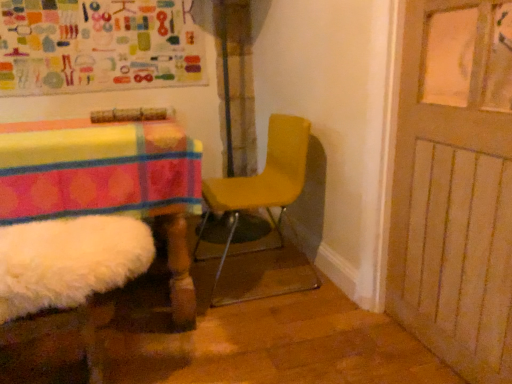
Find the location of a particular element. The image size is (512, 384). vacant space in front of yellow matte chair at center is located at coordinates [252, 331].